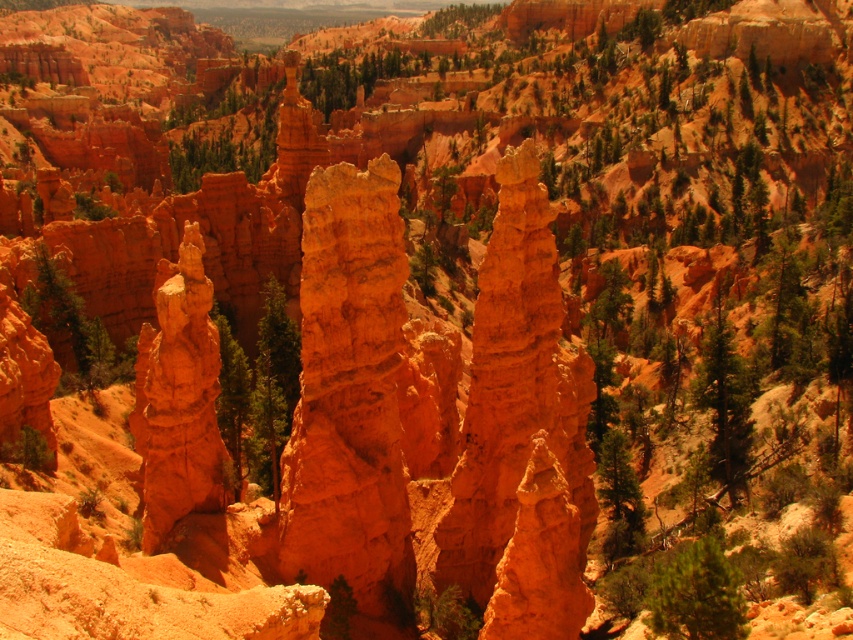
Does orange sandstone hoodoo at center come in front of green textured tree at lower right?

That is False.

Is orange sandstone hoodoo at center further to camera compared to green textured tree at lower right?

Yes, it is behind green textured tree at lower right.

What do you see at coordinates (178, 397) in the screenshot? The height and width of the screenshot is (640, 853). I see `orange sandstone hoodoo at center` at bounding box center [178, 397].

At what (x,y) coordinates should I click in order to perform the action: click on orange sandstone hoodoo at center. Please return your answer as a coordinate pair (x, y). Image resolution: width=853 pixels, height=640 pixels. Looking at the image, I should click on (178, 397).

Between orange sandstone hoodoo at center and green textured tree at right, which one is positioned higher?

green textured tree at right is higher up.

The height and width of the screenshot is (640, 853). What are the coordinates of `orange sandstone hoodoo at center` in the screenshot? It's located at (178, 397).

Who is more forward, (682, 596) or (711, 472)?

Point (682, 596)

Who is more forward, (680, 596) or (717, 380)?

Point (680, 596) is more forward.

I want to click on green textured tree at lower right, so pos(695,595).